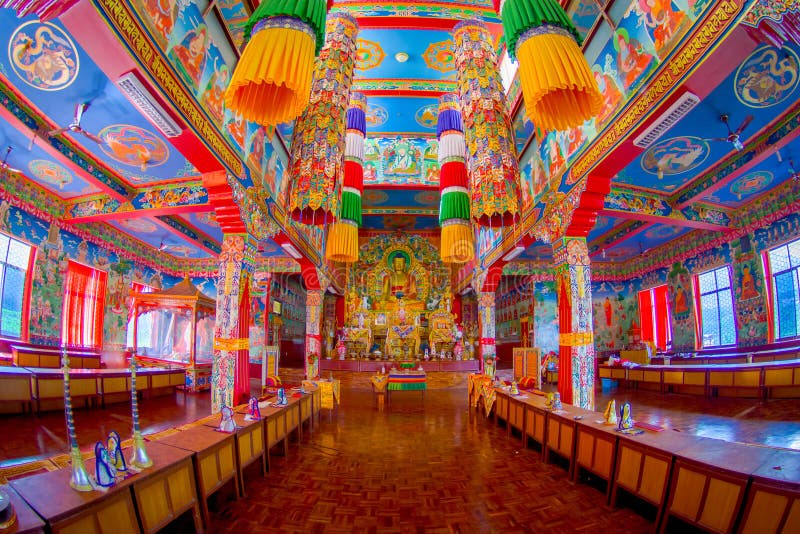
Where is `curtains`? This screenshot has width=800, height=534. curtains is located at coordinates (89, 285), (644, 309), (656, 309).